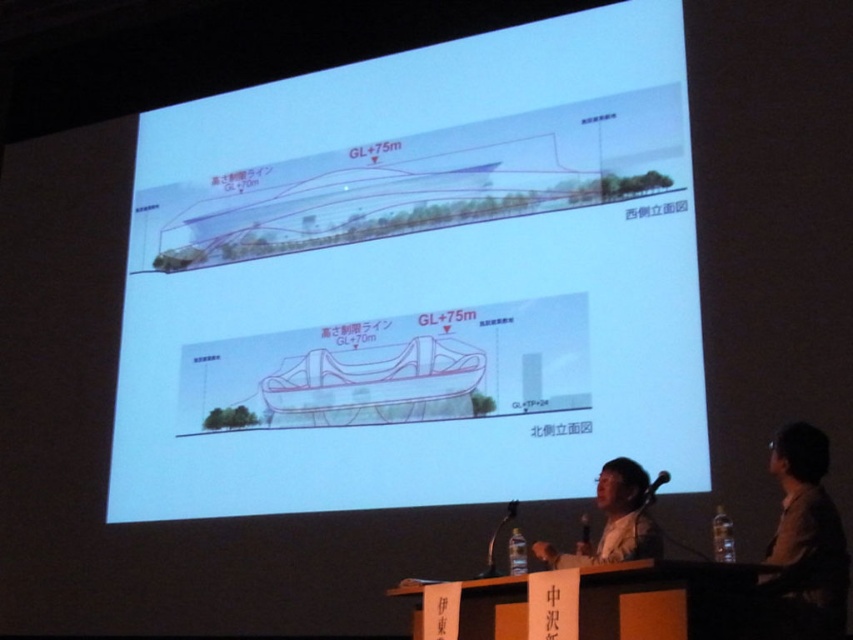
Can you confirm if white paper at center is positioned above matte black person at lower center?

Yes, white paper at center is above matte black person at lower center.

Is white paper at center smaller than matte black person at lower center?

No.

Which is in front, point (494, 259) or point (646, 483)?

Positioned in front is point (646, 483).

Where is `white paper at center`? This screenshot has height=640, width=853. white paper at center is located at coordinates (416, 280).

Which is in front, point (289, 260) or point (821, 564)?

Point (821, 564) is more forward.

Is point (698, 486) positioned before point (813, 476)?

No, it is not.

Who is more forward, (368,323) or (788,472)?

Point (788,472) is more forward.

Locate an element on the screen. white paper at center is located at coordinates (416, 280).

Who is positioned more to the right, brown shirt at right or matte black person at lower center?

brown shirt at right

Does brown shirt at right appear on the left side of matte black person at lower center?

In fact, brown shirt at right is to the right of matte black person at lower center.

Is point (805, 460) positioned behind point (640, 544)?

No, it is in front of (640, 544).

Identify the location of brown shirt at right. The width and height of the screenshot is (853, 640). (804, 544).